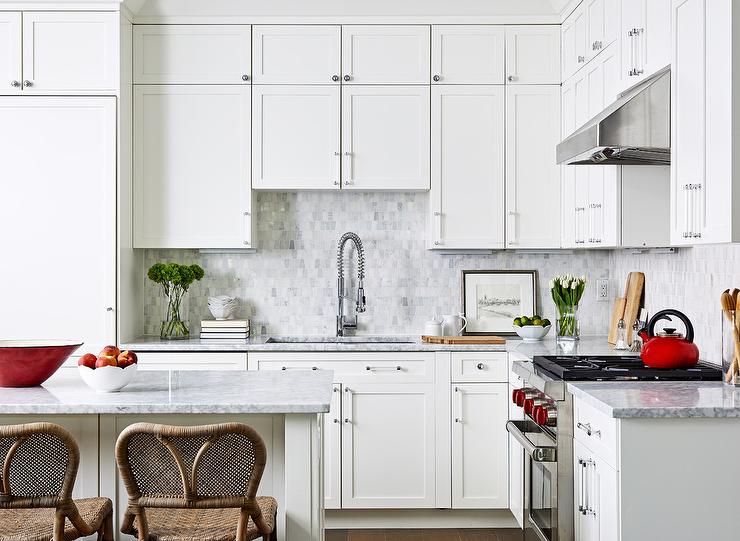
The width and height of the screenshot is (740, 541). I want to click on backsplash, so click(400, 272).